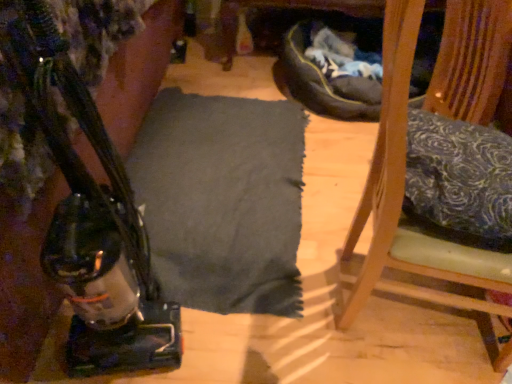
The height and width of the screenshot is (384, 512). Find the location of `empty space that is in between matte black vacuum cleaner at left and wooden chair at right`. empty space that is in between matte black vacuum cleaner at left and wooden chair at right is located at coordinates pyautogui.click(x=284, y=329).